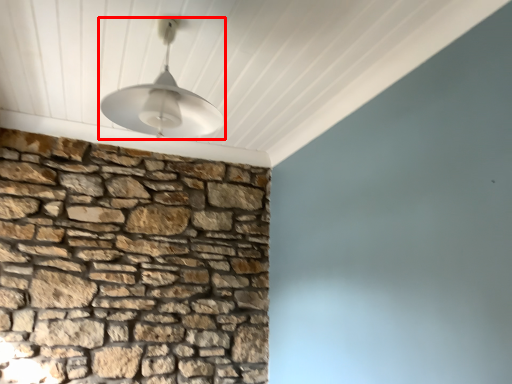
Question: From the image's perspective, where is lamp (annotated by the red box) located in relation to brickwork in the image?

Choices:
 (A) above
 (B) below

Answer: (A)